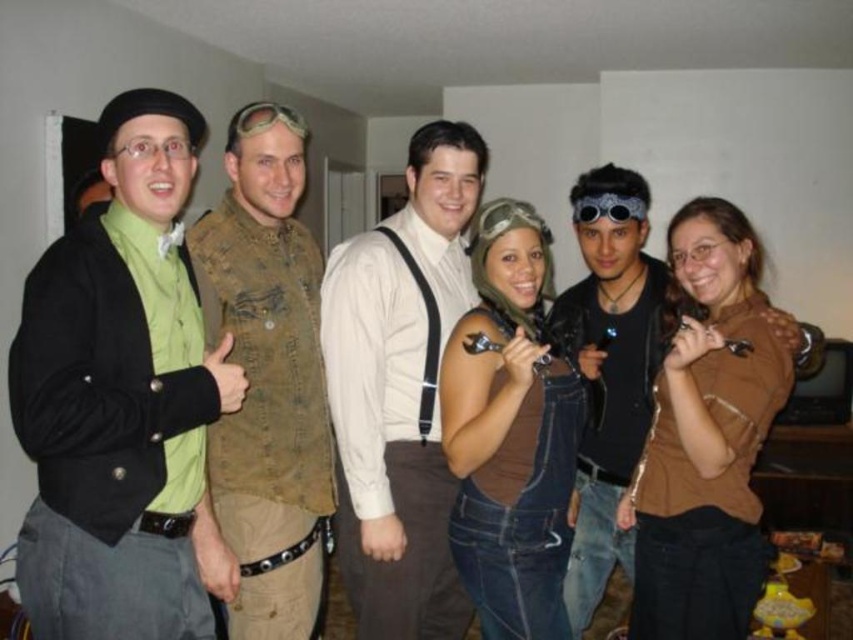
Question: Considering the relative positions of brown matte shirt at center and brown denim overalls at center in the image provided, where is brown matte shirt at center located with respect to brown denim overalls at center?

Choices:
 (A) below
 (B) above

Answer: (A)

Question: Which object is positioned closest to the black leather jacket at center?

Choices:
 (A) leather vest at center
 (B) brown matte shirt at center

Answer: (B)

Question: Estimate the real-world distances between objects in this image. Which object is farther from the metallic silver goggles at center?

Choices:
 (A) brown matte shirt at center
 (B) matte green shirt at left
 (C) metallic aviator goggles at upper center
 (D) leather vest at center

Answer: (B)

Question: Is the position of matte green shirt at left less distant than that of metallic aviator goggles at upper center?

Choices:
 (A) yes
 (B) no

Answer: (A)

Question: Can you confirm if matte green shirt at left is smaller than black leather jacket at center?

Choices:
 (A) yes
 (B) no

Answer: (B)

Question: Which of the following is the farthest from the observer?

Choices:
 (A) (267, 392)
 (B) (384, 541)
 (C) (601, 333)

Answer: (C)